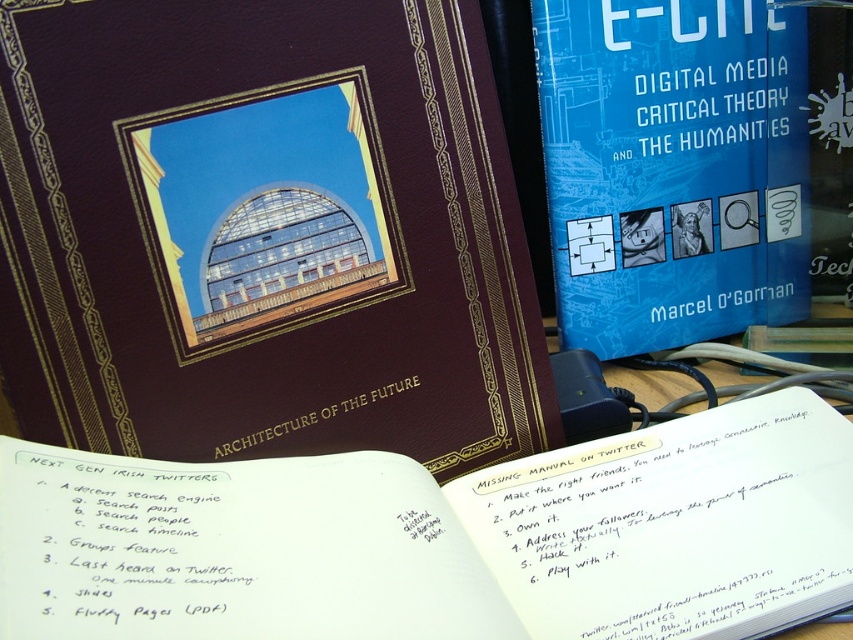
Can you confirm if matte brown book at center is positioned below blue paper at upper right?

Yes, matte brown book at center is below blue paper at upper right.

Does matte brown book at center have a lesser height compared to blue paper at upper right?

Yes.

Does point (57, 337) come behind point (642, 8)?

No, (57, 337) is in front of (642, 8).

The height and width of the screenshot is (640, 853). What are the coordinates of `matte brown book at center` in the screenshot? It's located at (289, 300).

Who is higher up, white paper at center or blue paper at upper right?

blue paper at upper right is above.

Is point (619, 632) closer to viewer compared to point (590, 106)?

Yes, it is in front of point (590, 106).

You are a GUI agent. You are given a task and a screenshot of the screen. Output one action in this format:
    pyautogui.click(x=<x>, y=<y>)
    Task: Click on the white paper at center
    This screenshot has width=853, height=640.
    Given the screenshot: What is the action you would take?
    pyautogui.click(x=442, y=538)

Does matte brown book at center appear on the right side of white paper at center?

In fact, matte brown book at center is to the left of white paper at center.

Does matte brown book at center have a greater height compared to white paper at center?

Yes, matte brown book at center is taller than white paper at center.

The image size is (853, 640). Describe the element at coordinates (289, 300) in the screenshot. I see `matte brown book at center` at that location.

Locate an element on the screen. The width and height of the screenshot is (853, 640). matte brown book at center is located at coordinates pyautogui.click(x=289, y=300).